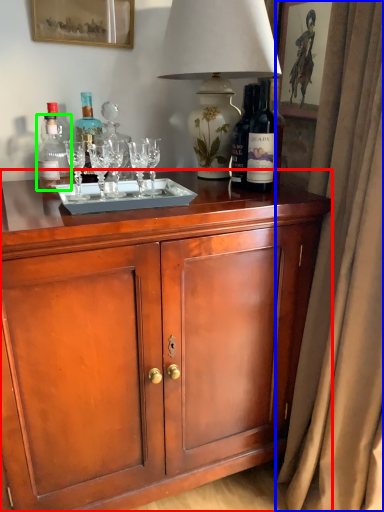
Question: Which object is positioned closest to cabinetry (highlighted by a red box)? Select from curtain (highlighted by a blue box) and bottle (highlighted by a green box).

Choices:
 (A) curtain
 (B) bottle

Answer: (A)